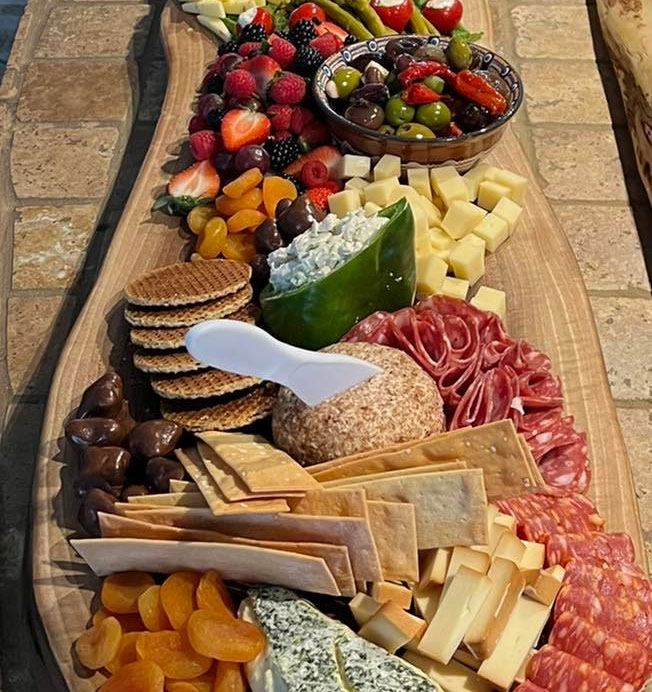
Locate an element on the screen. The image size is (652, 692). stone table is located at coordinates (44, 147), (613, 260).